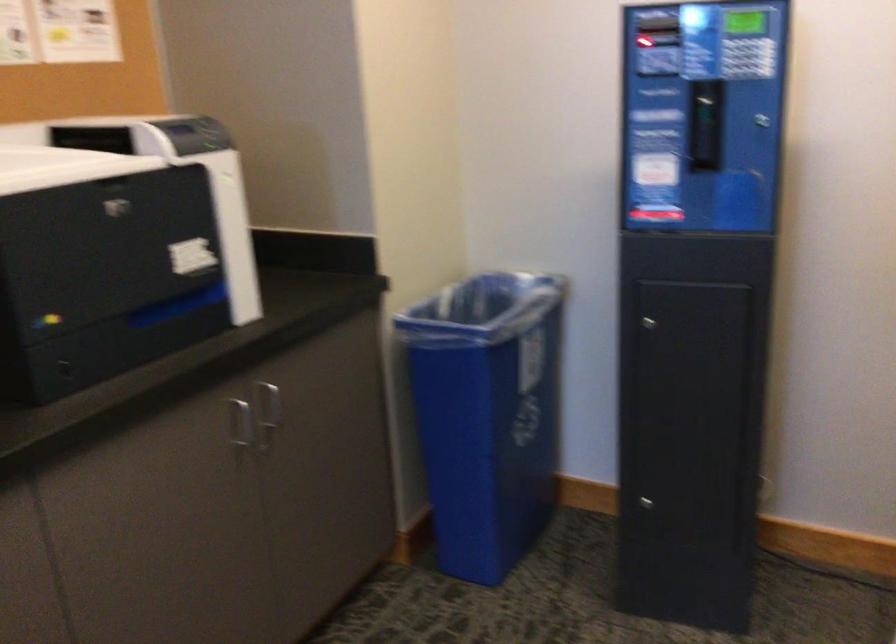
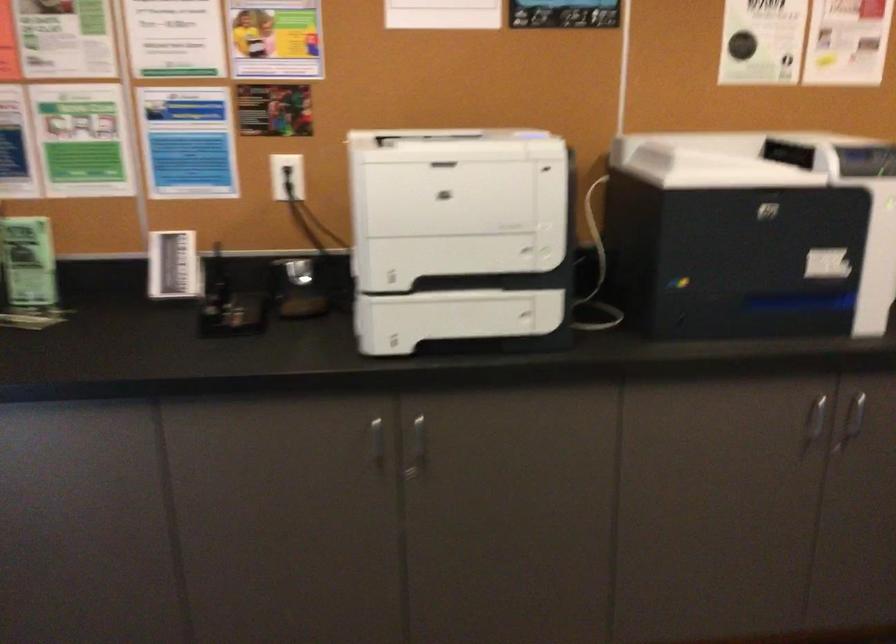
In the second image, find the point that corresponds to the point at 242,426 in the first image.

(815, 422)